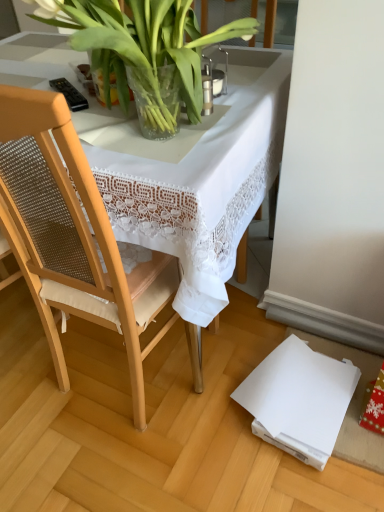
Question: Is clear glass vase at upper center bigger than wooden chair at left?

Choices:
 (A) yes
 (B) no

Answer: (B)

Question: Is clear glass vase at upper center facing away from wooden chair at left?

Choices:
 (A) no
 (B) yes

Answer: (B)

Question: Could wooden chair at left be considered to be inside clear glass vase at upper center?

Choices:
 (A) yes
 (B) no

Answer: (B)

Question: From a real-world perspective, is clear glass vase at upper center physically below wooden chair at left?

Choices:
 (A) yes
 (B) no

Answer: (B)

Question: Is there a large distance between clear glass vase at upper center and wooden chair at left?

Choices:
 (A) no
 (B) yes

Answer: (A)

Question: Considering the relative sizes of clear glass vase at upper center and wooden chair at left in the image provided, is clear glass vase at upper center taller than wooden chair at left?

Choices:
 (A) yes
 (B) no

Answer: (B)

Question: Does white lace tablecloth at center appear on the right side of clear glass vase at upper center?

Choices:
 (A) no
 (B) yes

Answer: (A)

Question: From a real-world perspective, is white lace tablecloth at center below clear glass vase at upper center?

Choices:
 (A) no
 (B) yes

Answer: (B)

Question: Is white lace tablecloth at center facing away from clear glass vase at upper center?

Choices:
 (A) yes
 (B) no

Answer: (B)

Question: Is white lace tablecloth at center taller than clear glass vase at upper center?

Choices:
 (A) yes
 (B) no

Answer: (A)

Question: Considering the relative sizes of white lace tablecloth at center and clear glass vase at upper center in the image provided, is white lace tablecloth at center smaller than clear glass vase at upper center?

Choices:
 (A) no
 (B) yes

Answer: (A)

Question: Is white lace tablecloth at center outside clear glass vase at upper center?

Choices:
 (A) no
 (B) yes

Answer: (B)

Question: Is wooden chair at left facing towards white lace tablecloth at center?

Choices:
 (A) no
 (B) yes

Answer: (B)